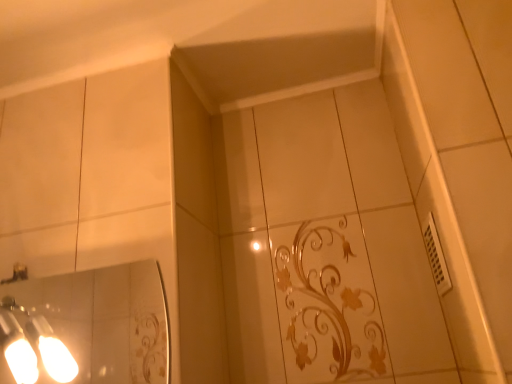
Question: Is matte silver light fixture at left wider or thinner than white plastic vent at right?

Choices:
 (A) wide
 (B) thin

Answer: (A)

Question: Would you say matte silver light fixture at left is inside or outside white plastic vent at right?

Choices:
 (A) inside
 (B) outside

Answer: (B)

Question: Is point (69, 369) closer or farther from the camera than point (428, 243)?

Choices:
 (A) farther
 (B) closer

Answer: (B)

Question: In terms of size, does white plastic vent at right appear bigger or smaller than matte silver light fixture at left?

Choices:
 (A) big
 (B) small

Answer: (B)

Question: Is white plastic vent at right to the left or to the right of matte silver light fixture at left in the image?

Choices:
 (A) right
 (B) left

Answer: (A)

Question: Is white plastic vent at right wider or thinner than matte silver light fixture at left?

Choices:
 (A) wide
 (B) thin

Answer: (B)

Question: From their relative heights in the image, would you say white plastic vent at right is taller or shorter than matte silver light fixture at left?

Choices:
 (A) short
 (B) tall

Answer: (A)